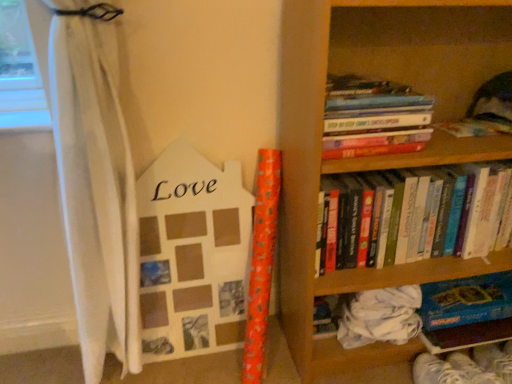
Question: In terms of width, does blue cardboard book at lower right, the third book viewed from the top, look wider or thinner when compared to hardcover books at upper right, which is counted as the first book, starting from the top?

Choices:
 (A) wide
 (B) thin

Answer: (A)

Question: Relative to hardcover books at upper right, arranged as the 3th book when ordered from the bottom, is blue cardboard book at lower right, the third book viewed from the top, in front or behind?

Choices:
 (A) front
 (B) behind

Answer: (B)

Question: Which of these objects is positioned farthest from the wooden photo frame at left?

Choices:
 (A) wooden bookcase at right
 (B) blue cardboard book at lower right, the third book viewed from the top
 (C) hardcover books at upper right, arranged as the 3th book when ordered from the bottom
 (D) hardcover books at upper right, positioned as the 2th book in bottom-to-top order

Answer: (B)

Question: Estimate the real-world distances between objects in this image. Which object is closer to the blue cardboard book at lower right, the third book viewed from the top?

Choices:
 (A) wooden photo frame at left
 (B) hardcover books at upper right, positioned as the 2th book in bottom-to-top order
 (C) wooden bookcase at right
 (D) hardcover books at upper right, arranged as the 3th book when ordered from the bottom

Answer: (B)